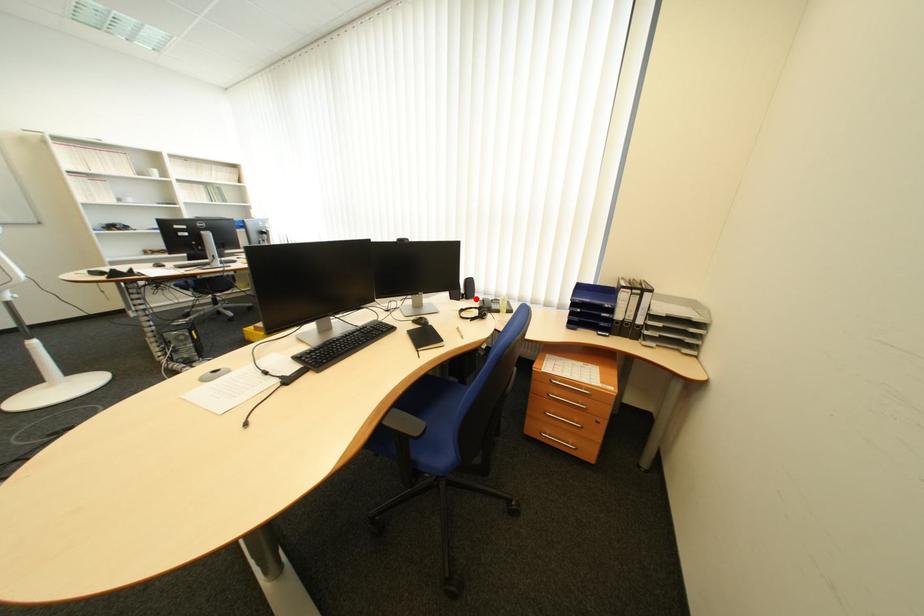
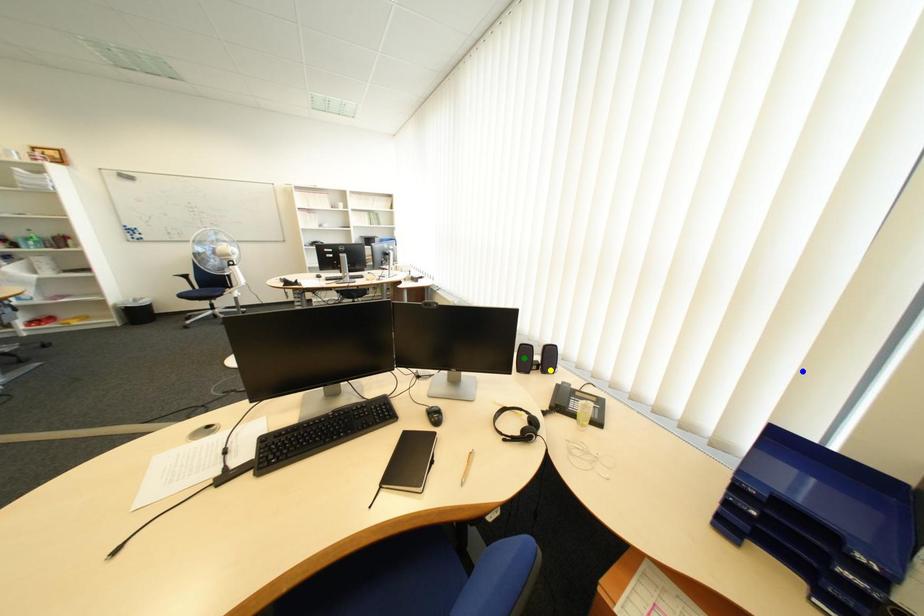
Question: I am providing you with two images of the same scene from different viewpoints. A red point is marked on the first image. You are given multiple points on the second image. Which point in image 2 is actually the same real-world point as the red point in image 1?

Choices:
 (A) yellow point
 (B) green point
 (C) blue point

Answer: (A)